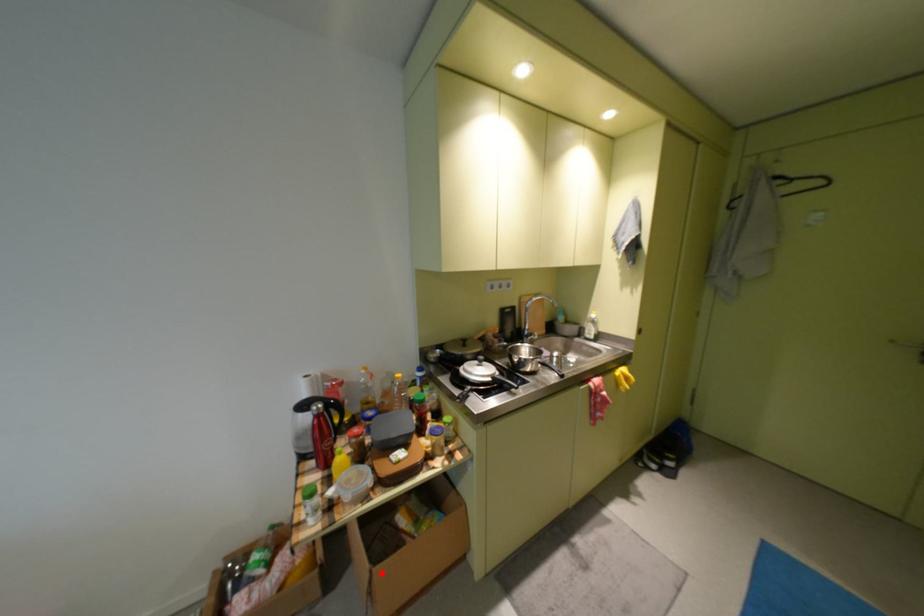
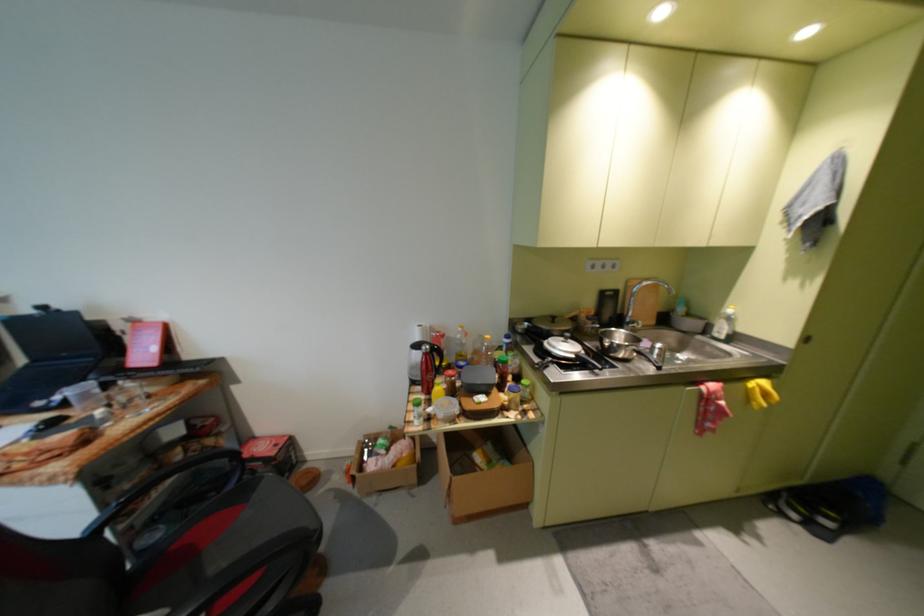
Question: I am providing you with two images of the same scene from different viewpoints. In image1, a red point is highlighted. Considering the same 3D point in image2, which of the following is correct?

Choices:
 (A) It is closer
 (B) It is farther

Answer: (A)